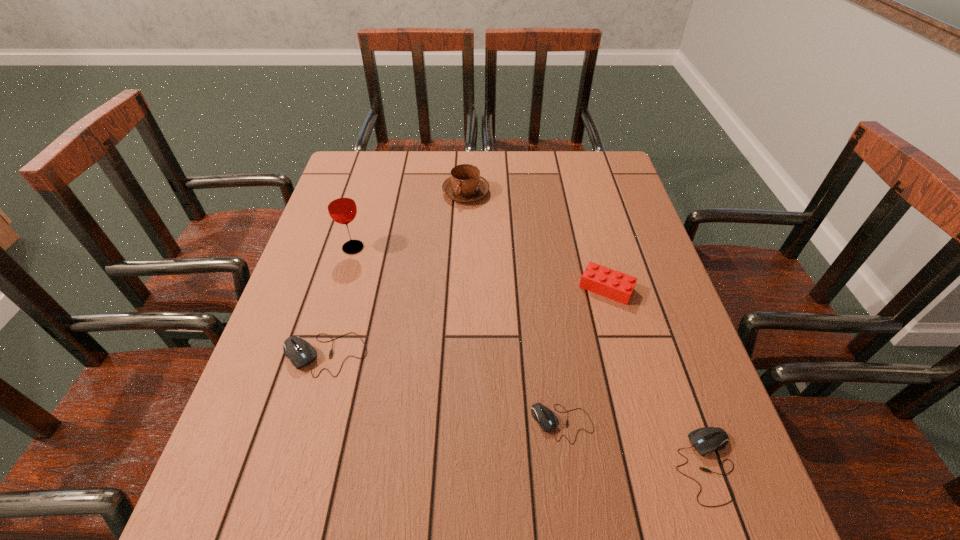
Please mark a free spot for a new mouse_(computer_equipment) to balance the arrangement. Please provide its 2D coordinates. Your answer should be formatted as a tuple, i.e. [(x, y)], where the tuple contains the x and y coordinates of a point satisfying the conditions above.

[(436, 387)]